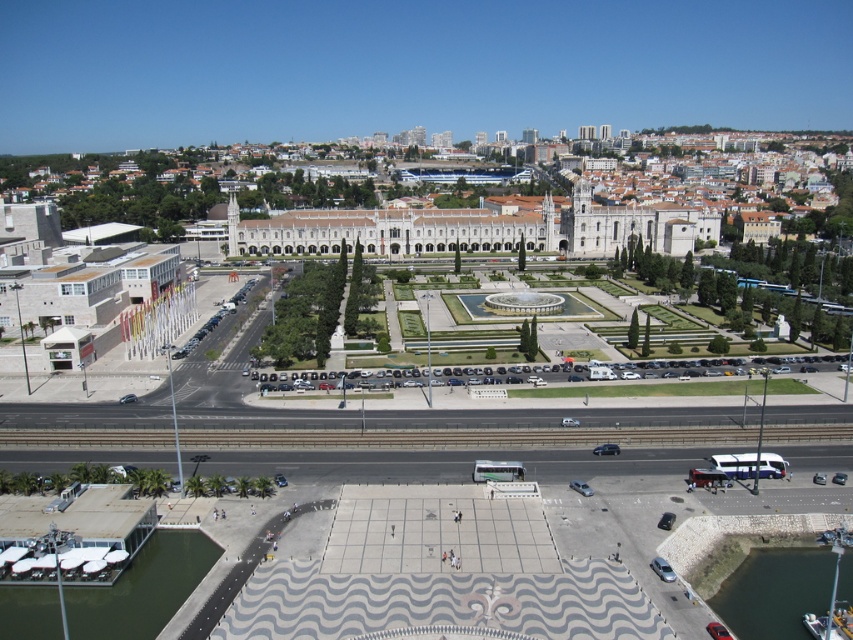
You are standing at the plaza and want to take a photo of both point markers. Which point marker, point (140, 624) or point (811, 588), is closer to you so that you can focus on it first?

Point (140, 624) is closer to the camera than point (811, 588), so you can focus on point (140, 624) first.